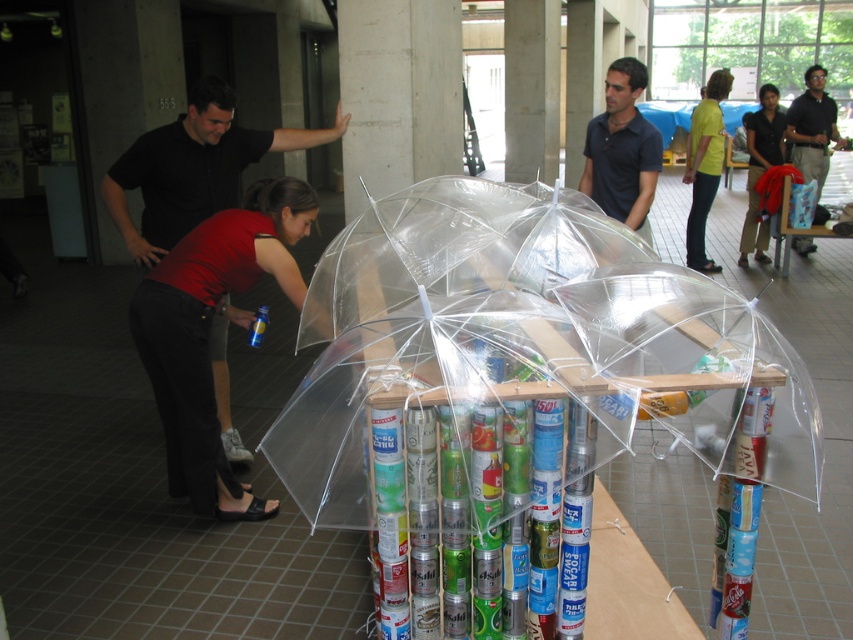
Question: Which of these objects is positioned farthest from the matte black shirt at center?

Choices:
 (A) matte black shirt at upper right
 (B) black polo shirt at upper right
 (C) matte red shirt at lower left
 (D) yellow matte shirt at upper right

Answer: (B)

Question: Is matte black shirt at center bigger than matte black shirt at upper right?

Choices:
 (A) no
 (B) yes

Answer: (A)

Question: Among these objects, which one is farthest from the camera?

Choices:
 (A) matte red shirt at lower left
 (B) yellow matte shirt at upper right
 (C) black polo shirt at upper right
 (D) matte black shirt at center

Answer: (C)

Question: Does yellow matte shirt at upper right appear over black polo shirt at upper right?

Choices:
 (A) yes
 (B) no

Answer: (B)

Question: Estimate the real-world distances between objects in this image. Which object is farther from the matte black shirt at upper right?

Choices:
 (A) yellow matte shirt at upper right
 (B) black polo shirt at upper right
 (C) matte black shirt at center
 (D) matte red shirt at lower left

Answer: (D)

Question: Does matte red shirt at lower left appear on the left side of black polo shirt at upper right?

Choices:
 (A) yes
 (B) no

Answer: (A)